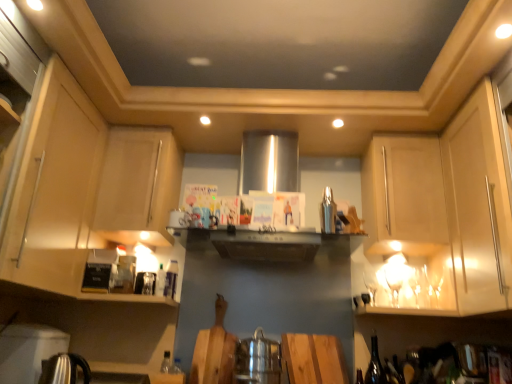
Question: Considering the relative sizes of matte wood cabinet at left, which is the 5th cabinetry from right to left, and matte wood cabinet at right, which is the 2th cabinetry in right-to-left order, in the image provided, is matte wood cabinet at left, which is the 5th cabinetry from right to left, smaller than matte wood cabinet at right, which is the 2th cabinetry in right-to-left order,?

Choices:
 (A) no
 (B) yes

Answer: (A)

Question: From a real-world perspective, is matte wood cabinet at left, which is the 5th cabinetry from right to left, positioned over matte wood cabinet at right, which is the 2th cabinetry in right-to-left order, based on gravity?

Choices:
 (A) yes
 (B) no

Answer: (B)

Question: From the image's perspective, is matte wood cabinet at left, the 1th cabinetry when ordered from left to right, located above matte wood cabinet at right, which is the 2th cabinetry in right-to-left order?

Choices:
 (A) yes
 (B) no

Answer: (A)

Question: From a real-world perspective, is matte wood cabinet at left, which is the 5th cabinetry from right to left, located beneath matte wood cabinet at right, which is the 2th cabinetry in right-to-left order?

Choices:
 (A) no
 (B) yes

Answer: (B)

Question: Would you say matte wood cabinet at right, the fourth cabinetry positioned from the left, is part of matte wood cabinet at left, which is the 5th cabinetry from right to left,'s contents?

Choices:
 (A) no
 (B) yes

Answer: (A)

Question: From the image's perspective, relative to matte wood cabinet at left, which is the 5th cabinetry from right to left, is matte wood cabinet at right, placed as the third cabinetry when sorted from right to left, above or below?

Choices:
 (A) below
 (B) above

Answer: (B)

Question: From a real-world perspective, is matte wood cabinet at right, the third cabinetry in the left-to-right sequence, above or below matte wood cabinet at left, the 1th cabinetry when ordered from left to right?

Choices:
 (A) below
 (B) above

Answer: (B)

Question: Considering the relative positions of matte wood cabinet at right, placed as the third cabinetry when sorted from right to left, and matte wood cabinet at left, the 1th cabinetry when ordered from left to right, in the image provided, is matte wood cabinet at right, placed as the third cabinetry when sorted from right to left, to the left or to the right of matte wood cabinet at left, the 1th cabinetry when ordered from left to right,?

Choices:
 (A) left
 (B) right

Answer: (B)

Question: Is matte wood cabinet at right, placed as the third cabinetry when sorted from right to left, situated inside matte wood cabinet at left, which is the 5th cabinetry from right to left, or outside?

Choices:
 (A) inside
 (B) outside

Answer: (B)

Question: Looking at the image, does dark brown glass bottle at lower right, the 1th wine bottle in the left-to-right sequence, seem bigger or smaller compared to metallic silver kettle at lower left, the second appliance when ordered from top to bottom?

Choices:
 (A) big
 (B) small

Answer: (B)

Question: In the image, is dark brown glass bottle at lower right, the 2th wine bottle from the right, positioned in front of or behind metallic silver kettle at lower left, the second appliance when ordered from top to bottom?

Choices:
 (A) front
 (B) behind

Answer: (B)

Question: From a real-world perspective, relative to metallic silver kettle at lower left, acting as the 3th appliance starting from the right, is dark brown glass bottle at lower right, the 2th wine bottle from the right, vertically above or below?

Choices:
 (A) above
 (B) below

Answer: (A)

Question: Which is correct: dark brown glass bottle at lower right, the 1th wine bottle in the left-to-right sequence, is inside metallic silver kettle at lower left, acting as the 3th appliance starting from the right, or outside of it?

Choices:
 (A) outside
 (B) inside

Answer: (A)

Question: Considering the relative positions of polished stainless steel kettle at lower left, acting as the second appliance starting from the left, and matte wood cabinet at upper left, positioned as the 4th cabinetry in right-to-left order, in the image provided, is polished stainless steel kettle at lower left, acting as the second appliance starting from the left, to the left or to the right of matte wood cabinet at upper left, positioned as the 4th cabinetry in right-to-left order,?

Choices:
 (A) right
 (B) left

Answer: (B)

Question: Based on their sizes in the image, would you say polished stainless steel kettle at lower left, which is the first appliance in bottom-to-top order, is bigger or smaller than matte wood cabinet at upper left, positioned as the 4th cabinetry in right-to-left order?

Choices:
 (A) small
 (B) big

Answer: (A)